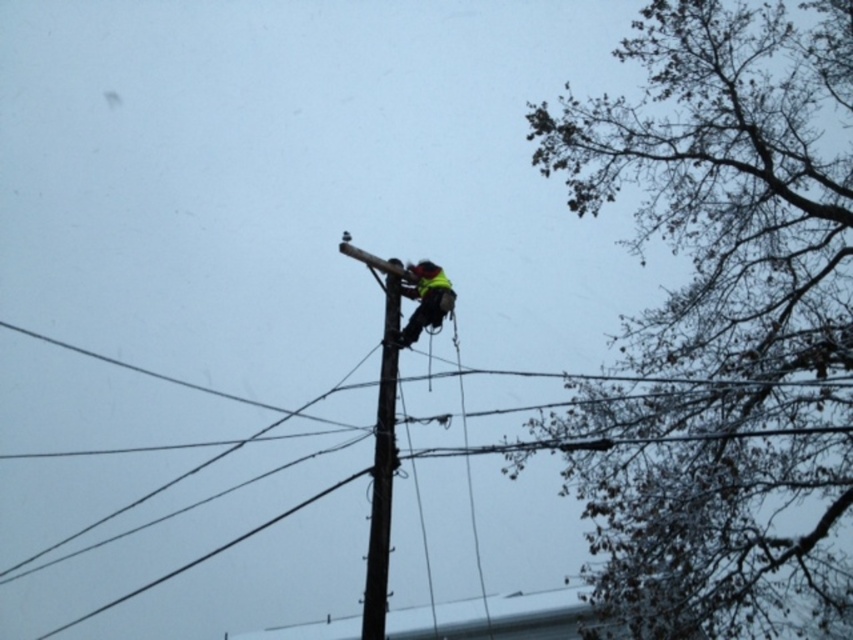
You are a utility worker looking at the scene. From your perspective, is the brown leafy tree at upper right located to the left or right of the reflective yellow safety vest at center?

The brown leafy tree at upper right is located to the right of the reflective yellow safety vest at center.

You are a pedestrian standing on the sidewalk and looking at the brown leafy tree at upper right and the reflective yellow safety vest at center. Which object is higher in the image?

The brown leafy tree at upper right is above the reflective yellow safety vest at center in the image.

You are a bird flying over the scene. You want to land on the taller object between the brown leafy tree at upper right and the brown wooden telegraph pole at center. Which one should you choose?

The brown wooden telegraph pole at center is taller than the brown leafy tree at upper right, so you should land on the brown wooden telegraph pole at center.